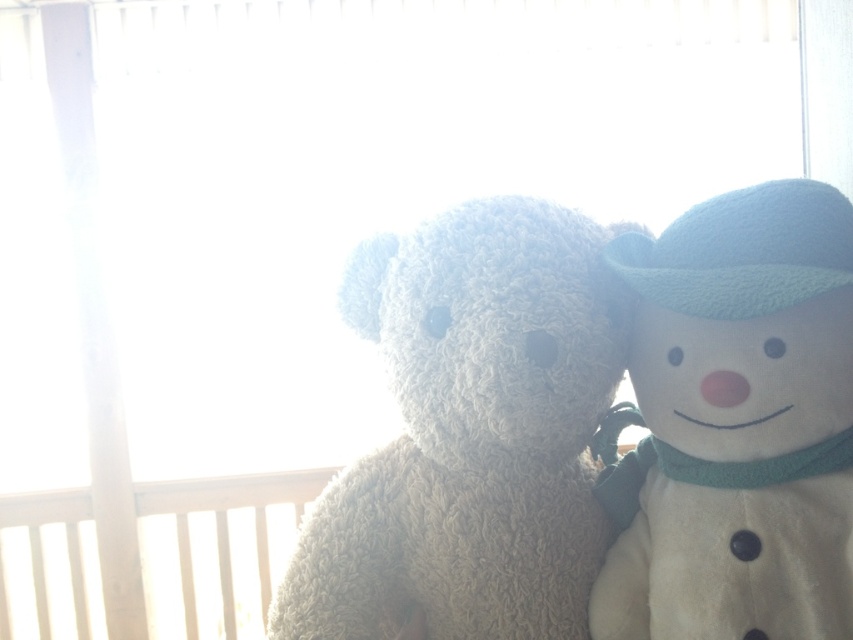
Is fluffy beige teddy bear at center taller than white plush snowman at right?

Indeed, fluffy beige teddy bear at center has a greater height compared to white plush snowman at right.

Between fluffy beige teddy bear at center and white plush snowman at right, which one has less height?

white plush snowman at right

Which is behind, point (505, 480) or point (682, 442)?

Positioned behind is point (505, 480).

Where is `fluffy beige teddy bear at center`? This screenshot has width=853, height=640. fluffy beige teddy bear at center is located at coordinates (469, 433).